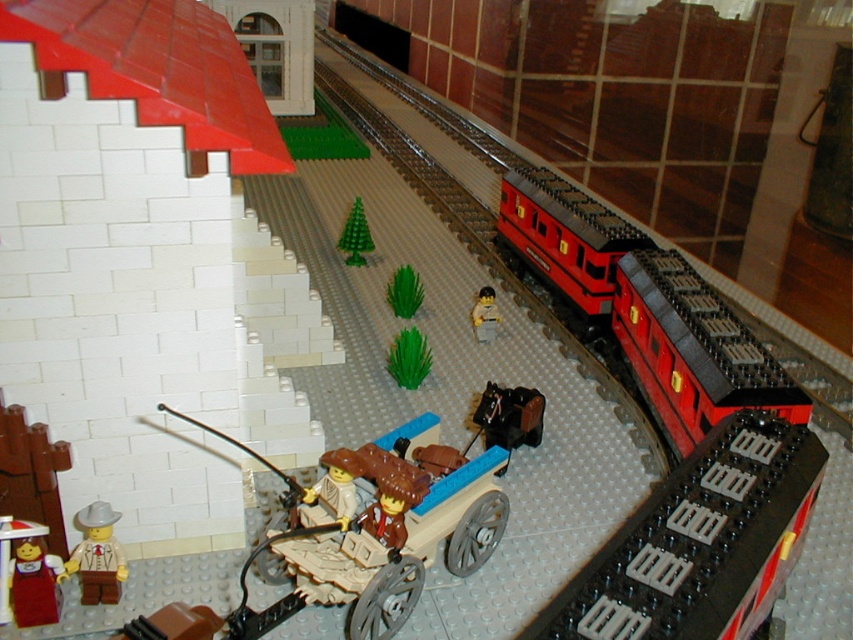
Does point (720, 595) come behind point (402, 333)?

No, (720, 595) is in front of (402, 333).

Identify the location of black plastic train at lower right. (699, 541).

Which is more to the left, light brown wood cowboy hat at lower left or smooth plastic minifigure at center?

Positioned to the left is light brown wood cowboy hat at lower left.

Which is behind, point (86, 541) or point (476, 332)?

The point (476, 332) is more distant.

Is point (57, 579) positioned behind point (485, 330)?

No, it is not.

I want to click on light brown wood cowboy hat at lower left, so click(x=97, y=556).

Between point (12, 616) and point (370, 241), which one is positioned behind?

Point (370, 241)

Between smooth red shirt at lower left and green plastic tree at center, which one appears on the right side from the viewer's perspective?

From the viewer's perspective, green plastic tree at center appears more on the right side.

Where is `smooth red shirt at lower left`? smooth red shirt at lower left is located at coordinates (27, 573).

Locate an element on the screen. smooth red shirt at lower left is located at coordinates (27, 573).